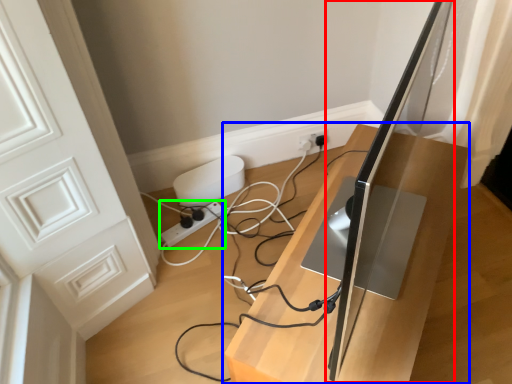
Question: Based on their relative distances, which object is nearer to computer monitor (highlighted by a red box)? Choose from furniture (highlighted by a blue box) and extension cord (highlighted by a green box).

Choices:
 (A) furniture
 (B) extension cord

Answer: (A)